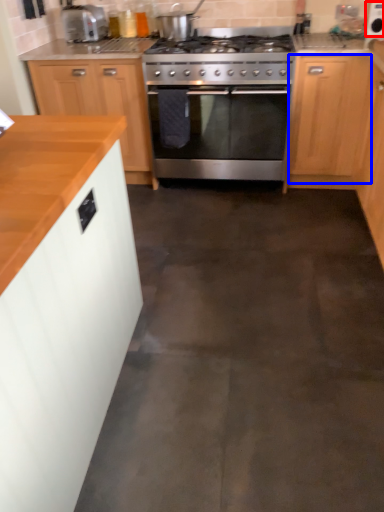
Question: Among these objects, which one is nearest to the camera, appliance (highlighted by a red box) or cabinetry (highlighted by a blue box)?

Choices:
 (A) appliance
 (B) cabinetry

Answer: (B)